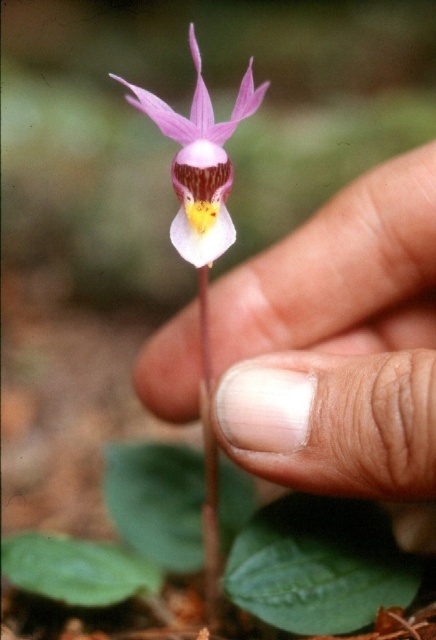
In the scene shown: You are a florist who wants to place the green matte stem at center into a vase. The smooth skin hand at center is currently holding it. How far apart are the hand and the stem?

The smooth skin hand at center is 6.47 inches from the green matte stem at center, so the distance between them is 6.47 inches.

You are holding a camera and want to take a closeup photo of the purple matte orchid at center. If your camera can focus on objects within 70 centimeters, will it be able to focus on the orchid?

The purple matte orchid at center is 71.05 centimeters from the viewer, which is slightly beyond the camera focus range of 70 centimeters. Therefore, the camera may not be able to focus on the orchid.

You are a photographer trying to capture the orchid in the image. The orchid is held by a smooth skin hand at center. To ensure the hand doesn not block the flower, you need to position your camera so that it focuses on the orchid. Given the coordinates of the hand, where should you aim your camera to avoid the hand?

The smooth skin hand at center is located at coordinates point (340,349). To avoid the hand, aim the camera slightly above or to the side of these coordinates, focusing on the orchid itself.